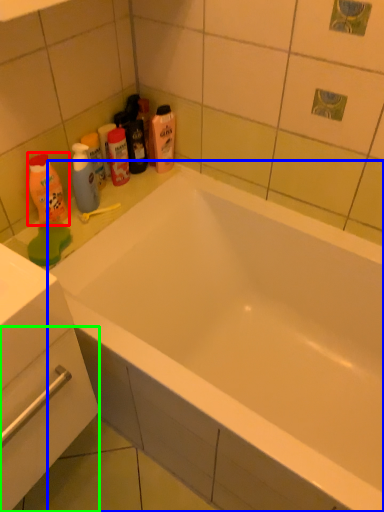
Question: Considering the real-world distances, which object is farthest from cleaning product (highlighted by a red box)? bathtub (highlighted by a blue box) or drawer (highlighted by a green box)?

Choices:
 (A) bathtub
 (B) drawer

Answer: (A)